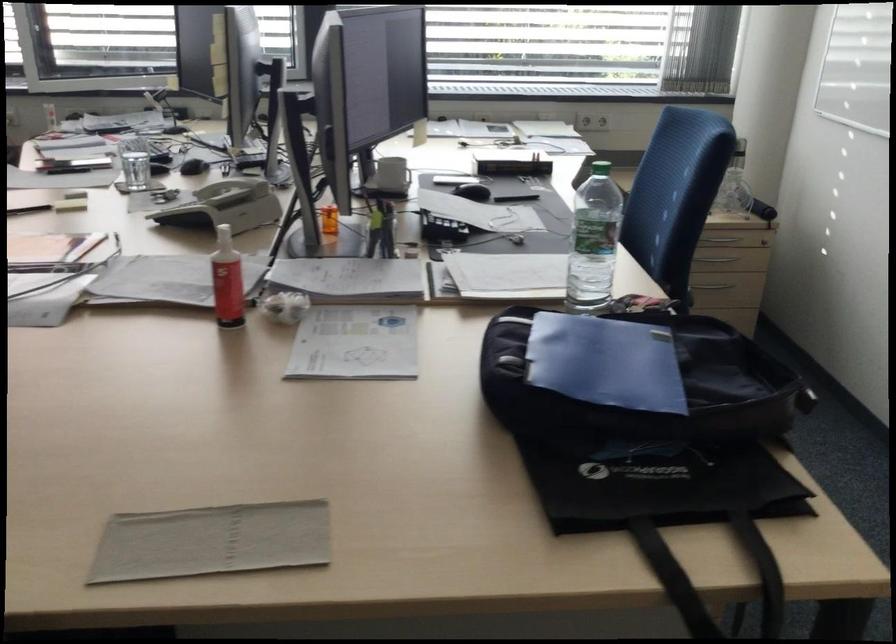
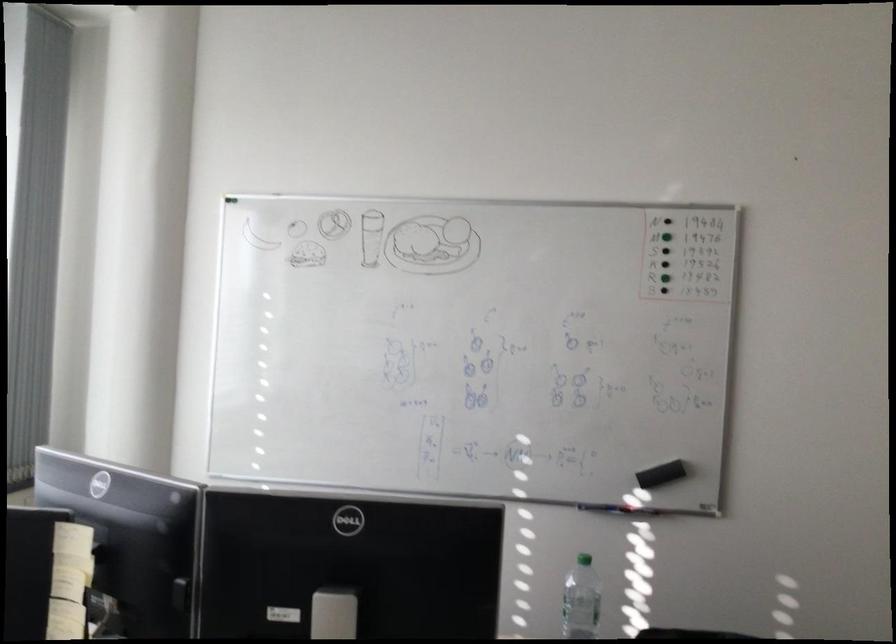
Where in the second image is the point corresponding to (x=612, y=230) from the first image?

(581, 600)